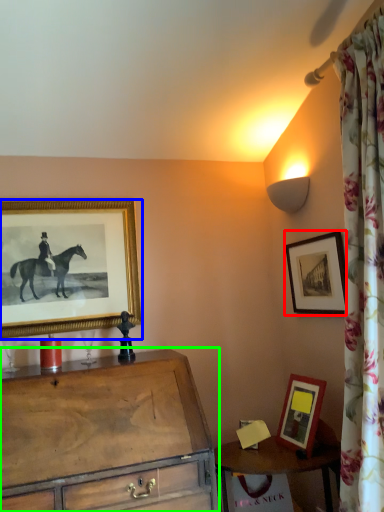
Question: Estimate the real-world distances between objects in this image. Which object is farther from picture frame (highlighted by a red box), picture frame (highlighted by a blue box) or chest of drawers (highlighted by a green box)?

Choices:
 (A) picture frame
 (B) chest of drawers

Answer: (A)